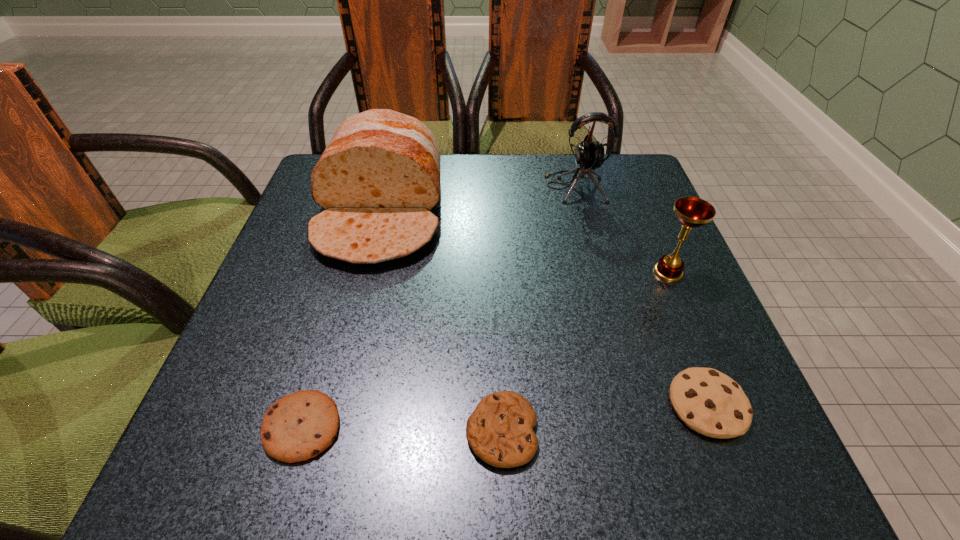
The image size is (960, 540). What are the coordinates of `vacant area situated 0.240m on the back of the fourth tallest object` in the screenshot? It's located at (653, 265).

Image resolution: width=960 pixels, height=540 pixels. What are the coordinates of `vacant area situated on the back of the leftmost cookie` in the screenshot? It's located at (321, 365).

Find the location of a particular element. This screenshot has width=960, height=540. vacant point located 0.320m on the left of the third object from left to right is located at coordinates (242, 431).

The height and width of the screenshot is (540, 960). I want to click on earphone present at the far edge, so click(x=589, y=156).

I want to click on bread located in the far edge section of the desktop, so click(378, 179).

Identify the location of bread located at the left edge. (378, 179).

Where is `cookie present at the left edge`? Image resolution: width=960 pixels, height=540 pixels. cookie present at the left edge is located at coordinates (297, 427).

This screenshot has height=540, width=960. In order to click on earphone that is at the right edge in this screenshot , I will do `click(589, 156)`.

In order to click on chalice that is at the right edge in this screenshot , I will do `click(692, 212)`.

The height and width of the screenshot is (540, 960). I want to click on cookie positioned at the right edge, so click(709, 402).